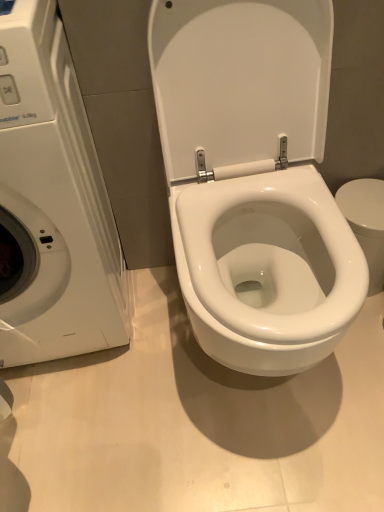
Question: Should I look upward or downward to see white glossy washing machine at left?

Choices:
 (A) down
 (B) up

Answer: (B)

Question: Is white glossy washing machine at left at the back of white glossy toilet at center?

Choices:
 (A) no
 (B) yes

Answer: (A)

Question: Is white glossy toilet at center positioned in front of white glossy washing machine at left?

Choices:
 (A) yes
 (B) no

Answer: (B)

Question: Considering the relative sizes of white glossy toilet at center and white glossy washing machine at left in the image provided, is white glossy toilet at center thinner than white glossy washing machine at left?

Choices:
 (A) yes
 (B) no

Answer: (A)

Question: Does white glossy toilet at center have a larger size compared to white glossy washing machine at left?

Choices:
 (A) no
 (B) yes

Answer: (A)

Question: Considering the relative sizes of white glossy toilet at center and white glossy washing machine at left in the image provided, is white glossy toilet at center shorter than white glossy washing machine at left?

Choices:
 (A) no
 (B) yes

Answer: (A)

Question: From the image's perspective, does white glossy toilet at center appear higher than white glossy washing machine at left?

Choices:
 (A) yes
 (B) no

Answer: (A)

Question: Is white glossy washing machine at left wider than white glossy toilet at center?

Choices:
 (A) yes
 (B) no

Answer: (A)

Question: Considering the relative sizes of white glossy washing machine at left and white glossy toilet at center in the image provided, is white glossy washing machine at left bigger than white glossy toilet at center?

Choices:
 (A) no
 (B) yes

Answer: (B)

Question: Is white glossy washing machine at left facing away from white glossy toilet at center?

Choices:
 (A) no
 (B) yes

Answer: (A)

Question: Is white glossy washing machine at left located outside white glossy toilet at center?

Choices:
 (A) no
 (B) yes

Answer: (B)

Question: Is white glossy washing machine at left not near white glossy toilet at center?

Choices:
 (A) yes
 (B) no

Answer: (B)

Question: Is white glossy washing machine at left surrounding white glossy toilet at center?

Choices:
 (A) no
 (B) yes

Answer: (A)

Question: Considering the relative positions of white glossy toilet at center and white glossy washing machine at left in the image provided, is white glossy toilet at center to the left or to the right of white glossy washing machine at left?

Choices:
 (A) right
 (B) left

Answer: (A)